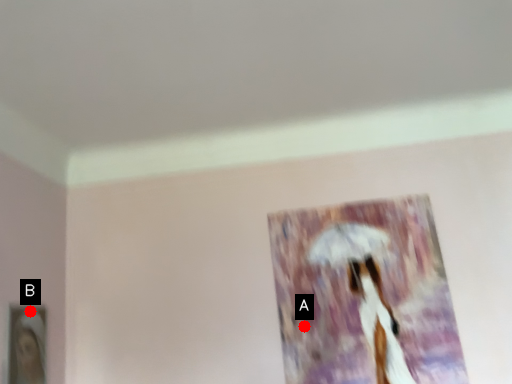
Question: Two points are circled on the image, labeled by A and B beside each circle. Which point is closer to the camera?

Choices:
 (A) A is closer
 (B) B is closer

Answer: (B)